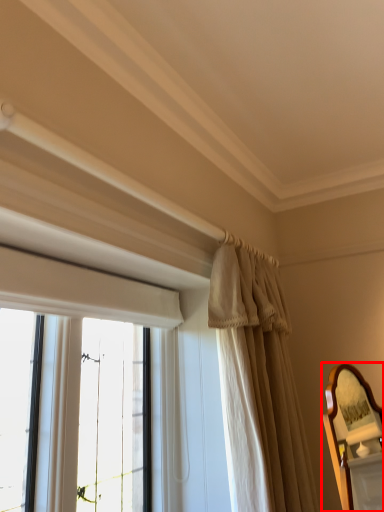
Question: From the image's perspective, considering the relative positions of mirror (annotated by the red box) and curtain in the image provided, where is mirror (annotated by the red box) located with respect to the staircase?

Choices:
 (A) above
 (B) below

Answer: (B)